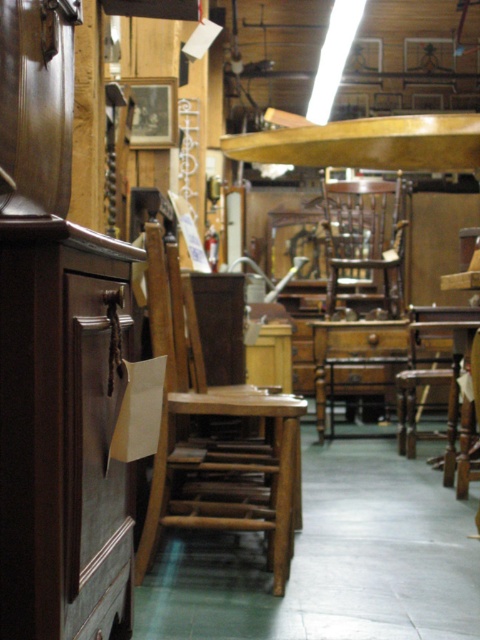
Question: Observing the image, what is the correct spatial positioning of wooden chair at center in reference to brown matte drawer at center?

Choices:
 (A) right
 (B) left

Answer: (B)

Question: Which point appears farthest from the camera in this image?

Choices:
 (A) (420, 308)
 (B) (290, 467)
 (C) (394, 189)
 (D) (392, 340)

Answer: (C)

Question: Is wooden chair at center above wooden table at center?

Choices:
 (A) no
 (B) yes

Answer: (A)

Question: From the image, what is the correct spatial relationship of wooden table at center in relation to brown matte drawer at center?

Choices:
 (A) right
 (B) left

Answer: (A)

Question: Which object appears farthest from the camera in this image?

Choices:
 (A) wooden table at center
 (B) wooden chair at center
 (C) mahogany wood chair at center
 (D) brown matte drawer at center

Answer: (D)

Question: Which object appears closest to the camera in this image?

Choices:
 (A) mahogany wood chair at center
 (B) wooden table at center
 (C) wooden chair at center

Answer: (C)